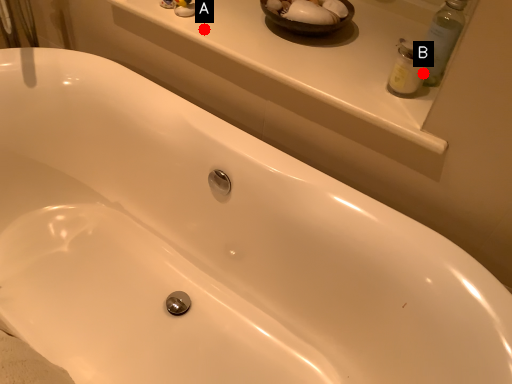
Question: Two points are circled on the image, labeled by A and B beside each circle. Which point is closer to the camera?

Choices:
 (A) A is closer
 (B) B is closer

Answer: (B)